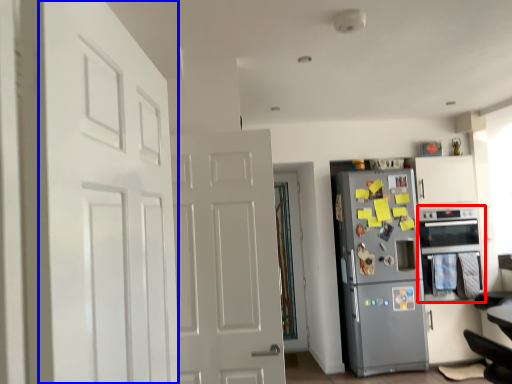
Question: Which of the following is the farthest to the observer, oven (highlighted by a red box) or door (highlighted by a blue box)?

Choices:
 (A) oven
 (B) door

Answer: (A)